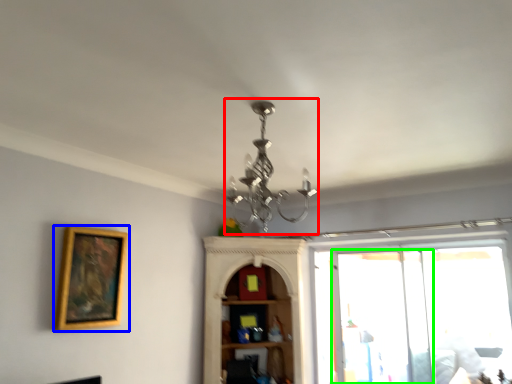
Question: Which object is positioned farthest from light fixture (highlighted by a red box)? Select from picture frame (highlighted by a blue box) and screen door (highlighted by a green box).

Choices:
 (A) picture frame
 (B) screen door

Answer: (B)